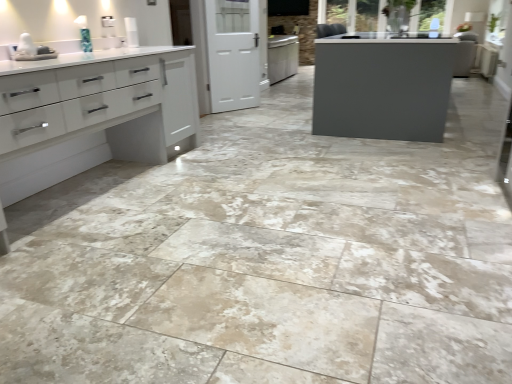
The image size is (512, 384). Find the location of `free location in front of white matte screen door at center`. free location in front of white matte screen door at center is located at coordinates (236, 116).